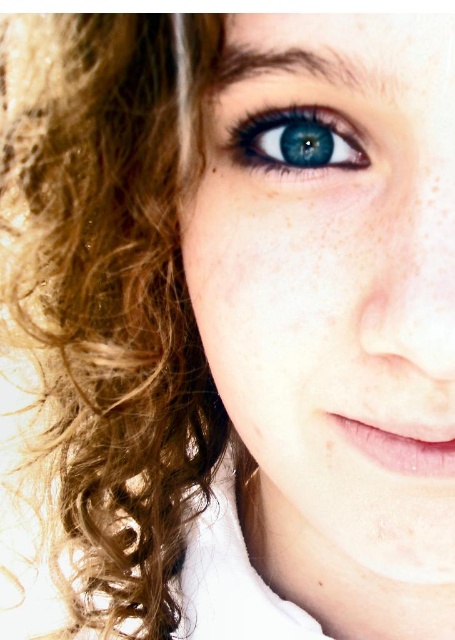
Measure the distance between smooth skin face at center and curly brown hair at left.

smooth skin face at center and curly brown hair at left are 3.28 inches apart.

Between point (248, 284) and point (77, 52), which one is positioned behind?

The point (248, 284) is behind.

Which is in front, point (416, 104) or point (126, 323)?

Positioned in front is point (416, 104).

Identify the location of smooth skin face at center. (337, 275).

Is point (110, 268) closer to camera compared to point (263, 122)?

No.

Which is in front, point (96, 573) or point (233, 129)?

Point (233, 129) is in front.

Which is in front, point (162, 166) or point (307, 161)?

Point (307, 161)

Where is `curly brown hair at left`? The image size is (455, 640). curly brown hair at left is located at coordinates (117, 289).

Can you confirm if curly brown hair at left is positioned to the left of brown matte freckle at lower right?

Indeed, curly brown hair at left is positioned on the left side of brown matte freckle at lower right.

Can you confirm if curly brown hair at left is smaller than brown matte freckle at lower right?

Actually, curly brown hair at left might be larger than brown matte freckle at lower right.

Which is in front, point (106, 300) or point (317, 586)?

Point (106, 300) is more forward.

You are a GUI agent. You are given a task and a screenshot of the screen. Output one action in this format:
    pyautogui.click(x=<x>, y=<y>)
    Task: Click on the curly brown hair at left
    The height and width of the screenshot is (640, 455).
    Given the screenshot: What is the action you would take?
    pyautogui.click(x=117, y=289)